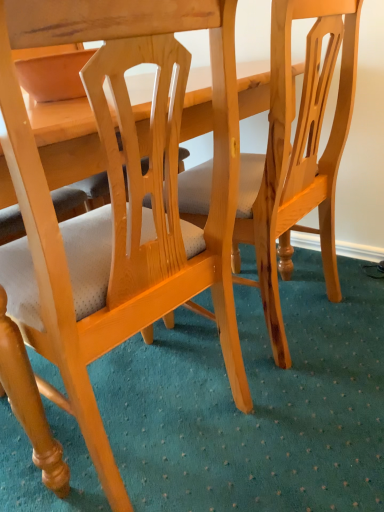
Image resolution: width=384 pixels, height=512 pixels. Identify the location of free region under light brown wood chair at center, which ranks as the 2th chair in right-to-left order (from a real-world perspective). (158, 423).